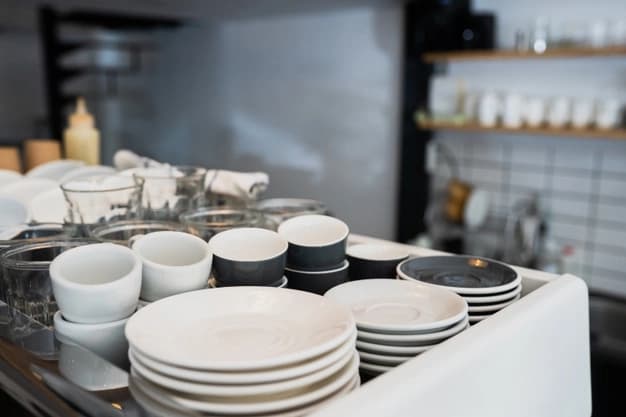
Where is `white plate`? The width and height of the screenshot is (626, 417). white plate is located at coordinates (238, 326), (240, 376), (242, 390), (247, 401), (298, 411), (394, 319), (392, 337), (394, 347), (386, 357), (376, 369).